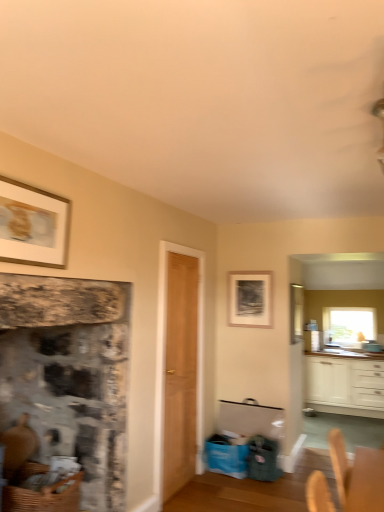
Question: Considering the positions of rustic stone fireplace at left and matte black picture frame at center, the 2th picture frame viewed from the front, in the image, is rustic stone fireplace at left bigger or smaller than matte black picture frame at center, the 2th picture frame viewed from the front,?

Choices:
 (A) big
 (B) small

Answer: (A)

Question: From a real-world perspective, is rustic stone fireplace at left positioned above or below matte black picture frame at center, the 2th picture frame viewed from the front?

Choices:
 (A) below
 (B) above

Answer: (A)

Question: Which object is positioned closest to the clear glass window at upper right?

Choices:
 (A) light brown wood door at center
 (B) woven brown basket at lower left
 (C) gold-framed picture at upper left, which ranks as the second picture frame in back-to-front order
 (D) white glossy cabinets at lower right
 (E) matte black picture frame at center, which is counted as the first picture frame, starting from the right

Answer: (D)

Question: Which of these objects is positioned closest to the clear glass window screen at upper right?

Choices:
 (A) matte black picture frame at center, the 2th picture frame viewed from the front
 (B) gold-framed picture at upper left, which ranks as the second picture frame in bottom-to-top order
 (C) white glossy cabinets at lower right
 (D) light brown wood door at center
 (E) woven brown basket at lower left

Answer: (C)